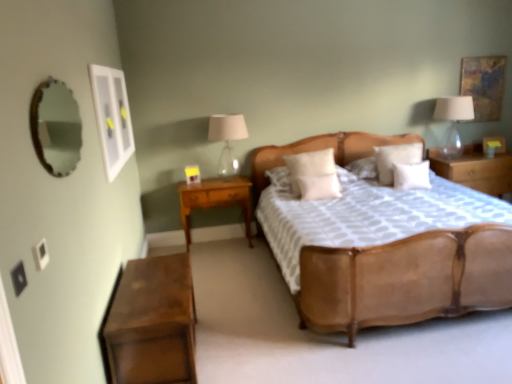
You are a GUI agent. You are given a task and a screenshot of the screen. Output one action in this format:
    pyautogui.click(x=<x>, y=<y>)
    Task: Click on the free space underneath matte glass lampshade at center, the second bedside lamp in the right-to-left sequence (from a real-world perspective)
    The height and width of the screenshot is (384, 512).
    Given the screenshot: What is the action you would take?
    pyautogui.click(x=227, y=177)